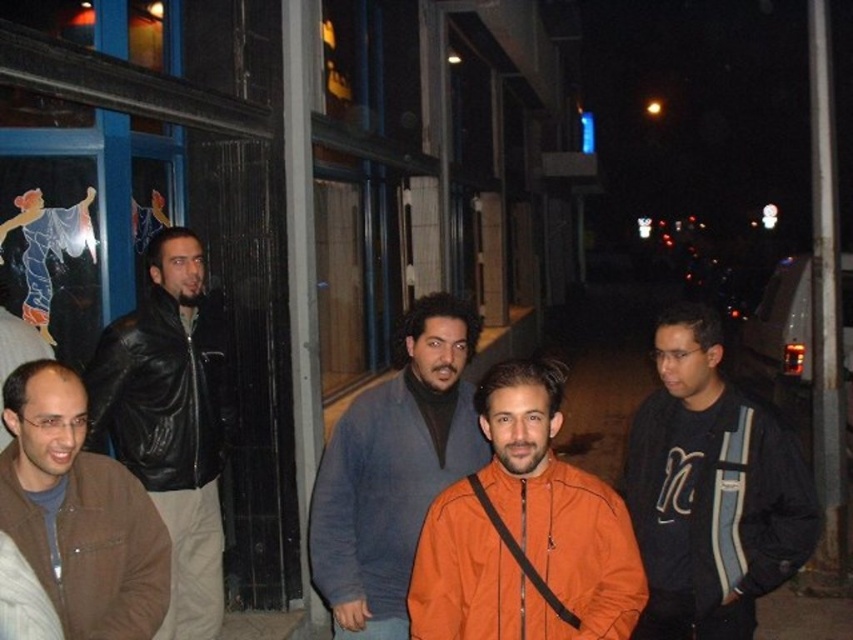
Question: Which of these objects is positioned farthest from the leather jacket at left?

Choices:
 (A) gray sweater at center
 (B) brown leather jacket at lower left
 (C) black matte jacket at right

Answer: (C)

Question: Can you confirm if orange matte jacket at center is positioned below gray sweater at center?

Choices:
 (A) no
 (B) yes

Answer: (A)

Question: Can you confirm if orange matte jacket at center is bigger than brown leather jacket at lower left?

Choices:
 (A) no
 (B) yes

Answer: (B)

Question: Can you confirm if black matte jacket at right is positioned below gray sweater at center?

Choices:
 (A) no
 (B) yes

Answer: (A)

Question: Considering the real-world distances, which object is farthest from the brown leather jacket at lower left?

Choices:
 (A) black matte jacket at right
 (B) gray sweater at center
 (C) orange matte jacket at center
 (D) leather jacket at left

Answer: (A)

Question: Which point is closer to the camera?

Choices:
 (A) orange matte jacket at center
 (B) leather jacket at left

Answer: (A)